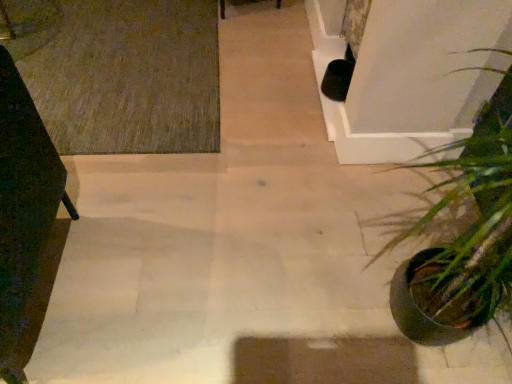
Identify the location of green matte plant pot at lower right. The width and height of the screenshot is (512, 384). click(x=459, y=233).

The width and height of the screenshot is (512, 384). What do you see at coordinates (459, 233) in the screenshot? I see `green matte plant pot at lower right` at bounding box center [459, 233].

Locate an element on the screen. This screenshot has width=512, height=384. green matte plant pot at lower right is located at coordinates (459, 233).